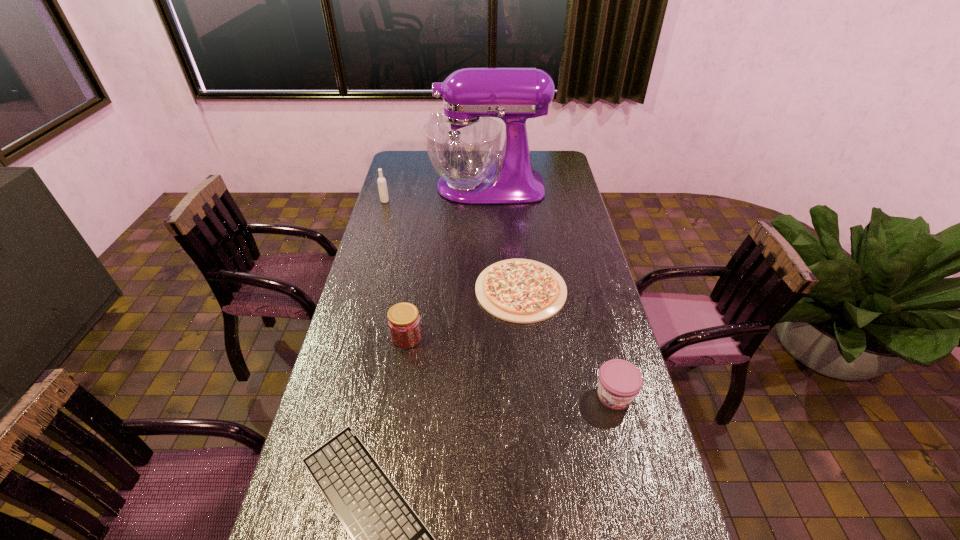
What are the coordinates of `free spot located at the bowl opening of the tallest object` in the screenshot? It's located at (400, 187).

Find the location of a particular element. vacant space located on the right of the second tallest object is located at coordinates (425, 201).

The width and height of the screenshot is (960, 540). What are the coordinates of `free spot located on the front of the third nearest object` in the screenshot? It's located at (396, 408).

Where is `free space located 0.060m on the front label of the shorter jam`? The height and width of the screenshot is (540, 960). free space located 0.060m on the front label of the shorter jam is located at coordinates (625, 435).

Identify the location of vacant area situated on the left of the pizza. (376, 290).

This screenshot has height=540, width=960. What are the coordinates of `object located in the far edge section of the desktop` in the screenshot? It's located at (463, 144).

Find the location of a particular element. Image resolution: width=960 pixels, height=540 pixels. vodka present at the left edge is located at coordinates (382, 185).

What are the coordinates of `jam that is at the left edge` in the screenshot? It's located at pos(404,323).

The height and width of the screenshot is (540, 960). In order to click on mixer located in the right edge section of the desktop in this screenshot , I will do `click(463, 144)`.

You are a GUI agent. You are given a task and a screenshot of the screen. Output one action in this format:
    pyautogui.click(x=<x>, y=<y>)
    Task: Click on the jam that is at the right edge
    The image size is (960, 540).
    Given the screenshot: What is the action you would take?
    pyautogui.click(x=620, y=381)